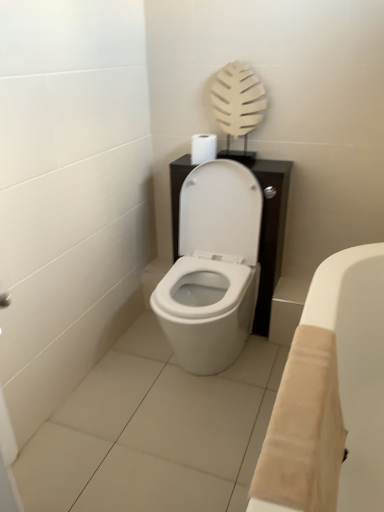
Question: From the image's perspective, is white matte toilet paper at center located above or below beige fabric bath at lower right?

Choices:
 (A) above
 (B) below

Answer: (A)

Question: Is point (210, 145) positioned closer to the camera than point (302, 373)?

Choices:
 (A) closer
 (B) farther

Answer: (B)

Question: From a real-world perspective, relative to beige fabric bath at lower right, is white matte toilet paper at center vertically above or below?

Choices:
 (A) below
 (B) above

Answer: (B)

Question: From the image's perspective, is beige fabric bath at lower right positioned above or below white matte toilet paper at center?

Choices:
 (A) below
 (B) above

Answer: (A)

Question: From a real-world perspective, is beige fabric bath at lower right above or below white matte toilet paper at center?

Choices:
 (A) above
 (B) below

Answer: (B)

Question: Relative to white matte toilet paper at center, is beige fabric bath at lower right in front or behind?

Choices:
 (A) front
 (B) behind

Answer: (A)

Question: Considering the positions of point (321, 488) and point (203, 150), is point (321, 488) closer or farther from the camera than point (203, 150)?

Choices:
 (A) farther
 (B) closer

Answer: (B)